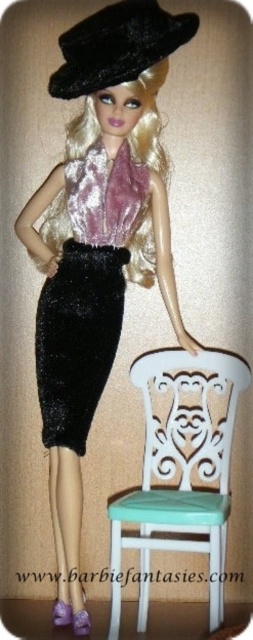
Consider the image. The user is trying to determine the spatial relationship between the velvet black skirt at center and the black velvet hat at upper center in the image. Which one is positioned lower?

The velvet black skirt at center is located below the black velvet hat at upper center, so the skirt is positioned lower than the hat.

The user is trying to take a photo of the velvet black skirt at center and the black velvet hat at upper center. They want to ensure both are in focus. Which object should they adjust their focus on first to capture both clearly?

The velvet black skirt at center is closer to the viewer than the black velvet hat at upper center. To capture both in focus, the user should focus on the velvet black skirt at center first, as it is the closer object. This will ensure the depth of field includes both the near and far subjects.

Based on the scene description, can you determine if the white painted wood chair at lower center is located directly underneath the velvet black skirt at center?

The white painted wood chair at lower center is positioned under the velvet black skirt at center, so yes, the chair is directly underneath the skirt.